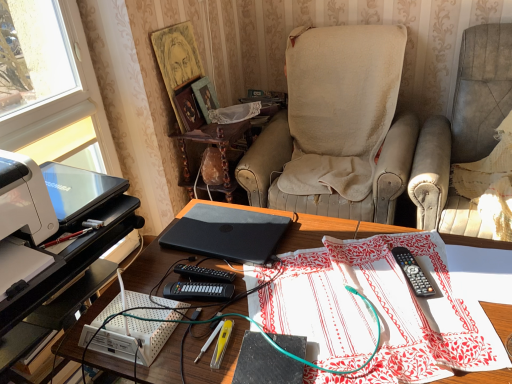
Where is `free region under white printed fabric at center (from a real-world perspective)`? free region under white printed fabric at center (from a real-world perspective) is located at coordinates (346, 310).